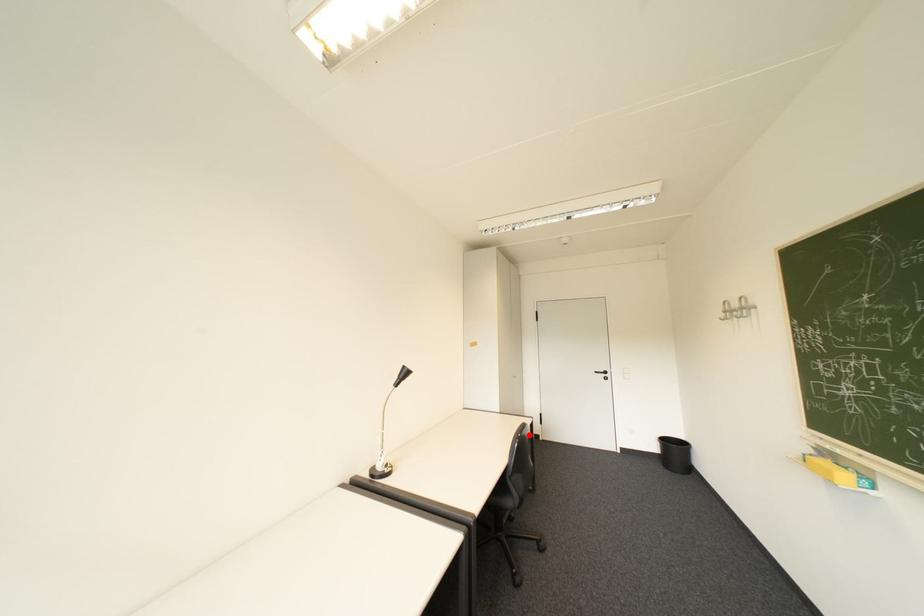
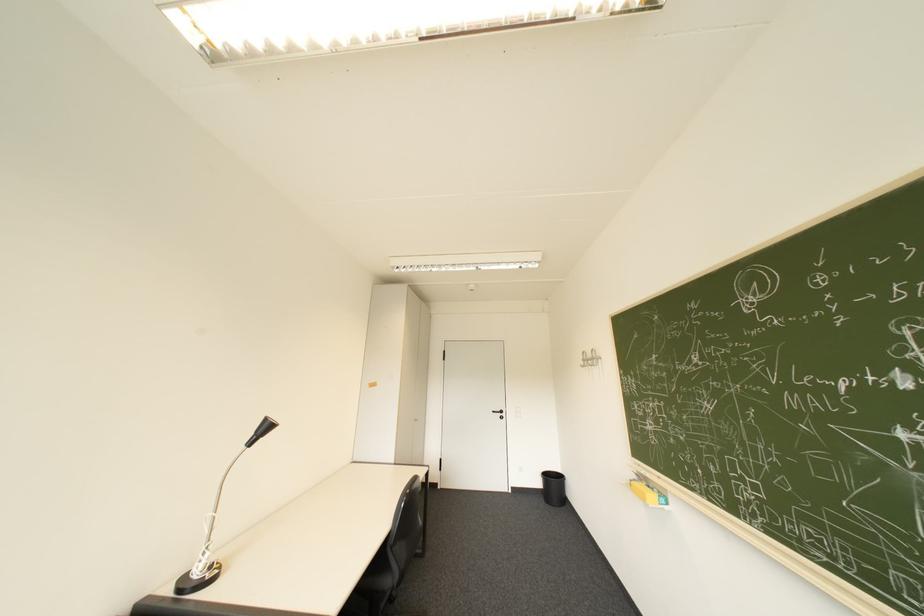
The point at the highlighted location is marked in the first image. Where is the corresponding point in the second image?

(419, 491)